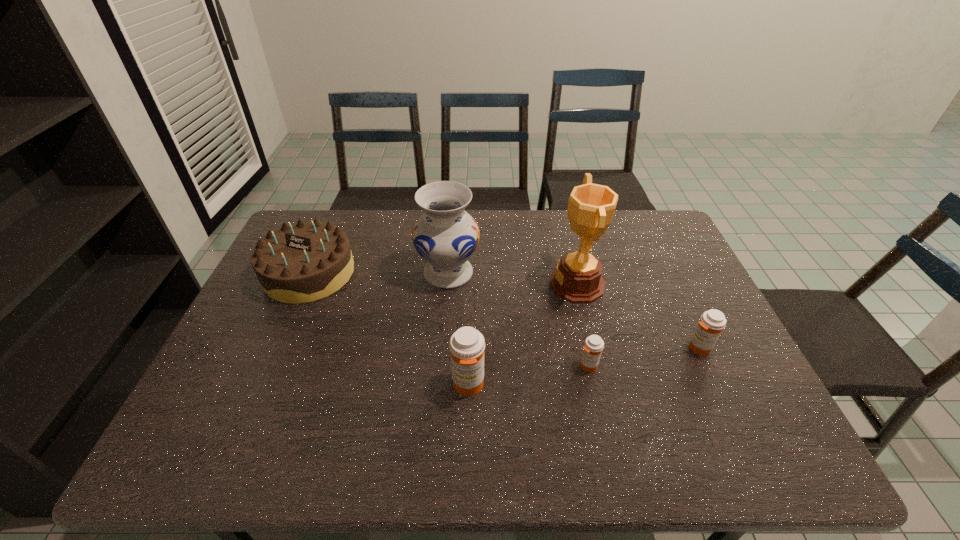
Locate an element on the screen. object positioned at the right edge is located at coordinates (712, 322).

The width and height of the screenshot is (960, 540). In order to click on object located in the far left corner section of the desktop in this screenshot , I will do `click(300, 263)`.

The height and width of the screenshot is (540, 960). In the image, there is a desktop. Identify the location of free space at the far edge. (393, 239).

Locate an element on the screen. This screenshot has height=540, width=960. vacant space at the near edge of the desktop is located at coordinates (566, 399).

At what (x,y) coordinates should I click in order to perform the action: click on free point at the left edge. Please return your answer as a coordinate pair (x, y). This screenshot has height=540, width=960. Looking at the image, I should click on (214, 385).

In order to click on free space at the right edge of the desktop in this screenshot , I will do `click(648, 256)`.

In the image, there is a desktop. Identify the location of vacant area at the near left corner. The width and height of the screenshot is (960, 540). coord(215,390).

Find the location of a particular element. The image size is (960, 540). free space between the leftmost object and the shortest object is located at coordinates (448, 320).

Locate an element on the screen. free area in between the shortest object and the leftmost object is located at coordinates click(448, 320).

Find the location of `blank region between the award and the second tallest object`. blank region between the award and the second tallest object is located at coordinates (513, 279).